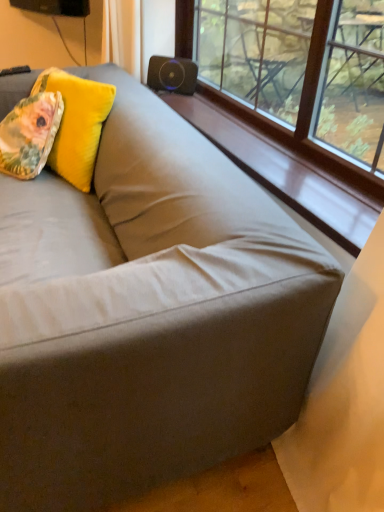
Identify the location of free spot above wooden at upper center (from a real-world perspective). (274, 148).